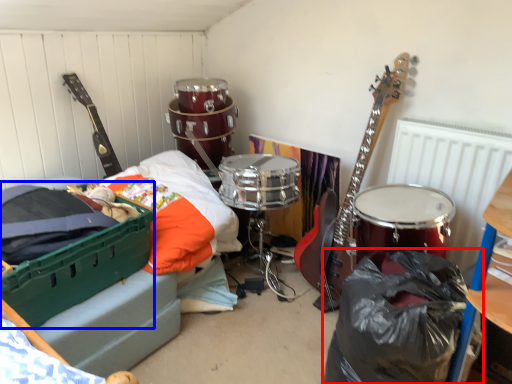
Question: Which point is further to the camera, garbage (highlighted by a red box) or storage box (highlighted by a blue box)?

Choices:
 (A) garbage
 (B) storage box

Answer: (B)